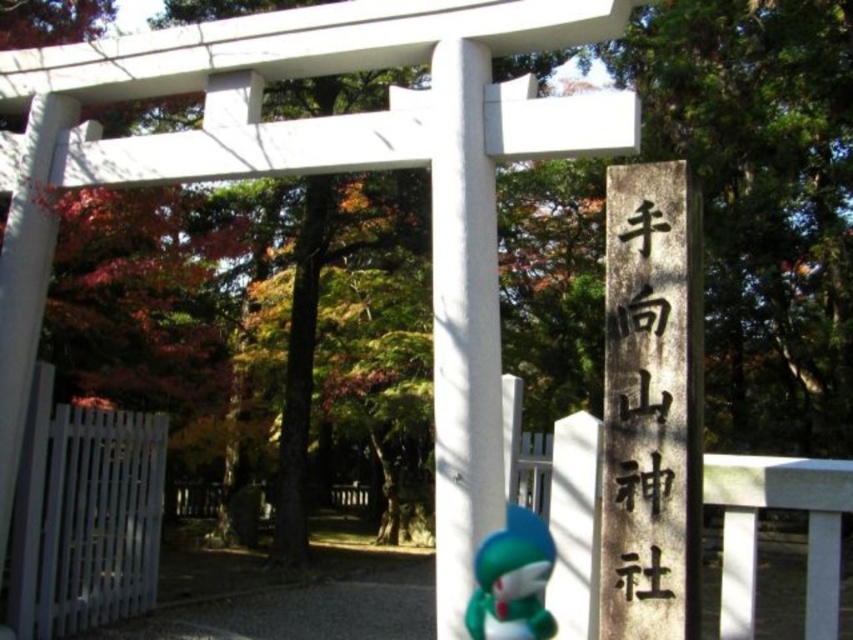
From the picture: You are a visitor at the Shinto shrine and see the black stone sign at right and the green matte plush toy at lower center. Which object is taller?

The black stone sign at right is taller than the green matte plush toy at lower center.

You are a visitor at the Shinto shrine and see the black stone sign at right and the green matte plush toy at lower center. Which object is bigger?

The black stone sign at right is larger in size than the green matte plush toy at lower center.

You are a tourist visiting a Shinto shrine and see the black stone sign at right and the green matte plush toy at lower center. Which object is positioned more to the east side of the scene?

The black stone sign at right is positioned to the right of the green matte plush toy at lower center, so it is more to the east side of the scene.